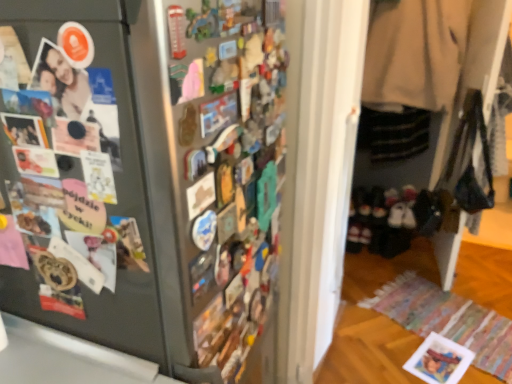
Describe the element at coordinates (85, 98) in the screenshot. I see `matte black photo at left` at that location.

Find the location of a particular element. Image resolution: width=512 pixels, height=384 pixels. satin black fridge at left is located at coordinates (149, 177).

Looking at this image, measure the distance between point (357, 243) and camera.

The depth of point (357, 243) is 2.82 meters.

Where is `beige wool coat at right`? This screenshot has height=384, width=512. beige wool coat at right is located at coordinates (415, 53).

Considering their positions, is beige wool coat at right located in front of or behind satin black fridge at left?

Clearly, beige wool coat at right is behind satin black fridge at left.

Image resolution: width=512 pixels, height=384 pixels. I want to click on clothing behind the satin black fridge at left, so click(415, 53).

Which is less distant, (383, 40) or (138, 121)?

Clearly, point (383, 40) is more distant from the camera than point (138, 121).

Is matte black photo at left oriented towards black suede shoes at lower right?

→ No.

Considering the points (69, 93) and (424, 230), which point is behind, point (69, 93) or point (424, 230)?

The point (424, 230) is behind.

Is matte black photo at left smaller than black suede shoes at lower right?

Yes.

Can you tell me how much satin black fridge at left and matte black photo at left differ in facing direction?

The angle between the facing direction of satin black fridge at left and the facing direction of matte black photo at left is 90.4 degrees.

Which object is more forward, satin black fridge at left or matte black photo at left?

satin black fridge at left is in front.

From the picture: From a real-world perspective, is satin black fridge at left above or below matte black photo at left?

In terms of real-world spatial position, satin black fridge at left is below matte black photo at left.

This screenshot has width=512, height=384. In order to click on footwear below the matte black photo at left (from a real-world perspective) in this screenshot , I will do `click(390, 220)`.

How far apart are black suede shoes at lower right and matte black photo at left?

A distance of 2.34 meters exists between black suede shoes at lower right and matte black photo at left.

From the image's perspective, is black suede shoes at lower right over matte black photo at left?

Incorrect, from the image's perspective, black suede shoes at lower right is lower than matte black photo at left.

Based on the photo, does black suede shoes at lower right have a smaller size compared to matte black photo at left?

No.

Is beige wool coat at right positioned with its back to matte black photo at left?

No, matte black photo at left is not at the back of beige wool coat at right.

Considering the positions of point (386, 78) and point (117, 130), is point (386, 78) closer or farther from the camera than point (117, 130)?

Point (386, 78).

Considering the sizes of beige wool coat at right and matte black photo at left in the image, is beige wool coat at right bigger or smaller than matte black photo at left?

Clearly, beige wool coat at right is larger in size than matte black photo at left.

Is beige wool coat at right not near matte black photo at left?

Yes, beige wool coat at right and matte black photo at left are quite far apart.

Considering the sizes of objects satin black fridge at left and beige wool coat at right in the image provided, who is shorter, satin black fridge at left or beige wool coat at right?

beige wool coat at right is shorter.

From a real-world perspective, who is located lower, satin black fridge at left or beige wool coat at right?

satin black fridge at left is physically lower.

Does satin black fridge at left have a larger size compared to beige wool coat at right?

Yes, satin black fridge at left is bigger than beige wool coat at right.

Which object is wider, satin black fridge at left or beige wool coat at right?

satin black fridge at left.

Are matte black photo at left and beige wool coat at right located far from each other?

matte black photo at left is far away from beige wool coat at right.

Considering the relative sizes of matte black photo at left and beige wool coat at right in the image provided, is matte black photo at left wider than beige wool coat at right?

In fact, matte black photo at left might be narrower than beige wool coat at right.

Would you say matte black photo at left contains beige wool coat at right?

Actually, beige wool coat at right is outside matte black photo at left.

Which of these two, matte black photo at left or beige wool coat at right, stands taller?

With more height is beige wool coat at right.

Where is `refrigerator on the left of beige wool coat at right`? The height and width of the screenshot is (384, 512). refrigerator on the left of beige wool coat at right is located at coordinates (149, 177).

Image resolution: width=512 pixels, height=384 pixels. I want to click on person that appears in front of the black suede shoes at lower right, so click(85, 98).

Looking at the image, which one is located further to beige wool coat at right, satin black fridge at left or matte black photo at left?

matte black photo at left is positioned further to the anchor beige wool coat at right.

Based on the photo, when comparing their distances from beige wool coat at right, does matte black photo at left or satin black fridge at left seem closer?

Among the two, satin black fridge at left is located nearer to beige wool coat at right.

When comparing their distances from beige wool coat at right, does black suede shoes at lower right or matte black photo at left seem further?

The object further to beige wool coat at right is matte black photo at left.

Based on their spatial positions, is satin black fridge at left or beige wool coat at right closer to black suede shoes at lower right?

beige wool coat at right lies closer to black suede shoes at lower right than the other object.

Considering their positions, is black suede shoes at lower right positioned further to matte black photo at left than beige wool coat at right?

black suede shoes at lower right is further to matte black photo at left.

Looking at the image, which one is located further to black suede shoes at lower right, matte black photo at left or beige wool coat at right?

matte black photo at left lies further to black suede shoes at lower right than the other object.

When comparing their distances from satin black fridge at left, does beige wool coat at right or black suede shoes at lower right seem further?

The object further to satin black fridge at left is black suede shoes at lower right.

Estimate the real-world distances between objects in this image. Which object is further from beige wool coat at right, satin black fridge at left or black suede shoes at lower right?

satin black fridge at left.

The height and width of the screenshot is (384, 512). I want to click on clothing between satin black fridge at left and black suede shoes at lower right in the front-back direction, so click(x=415, y=53).

Identify the location of person between satin black fridge at left and black suede shoes at lower right in the front-back direction. Image resolution: width=512 pixels, height=384 pixels. (85, 98).

The image size is (512, 384). What are the coordinates of `person positioned between satin black fridge at left and beige wool coat at right from near to far` in the screenshot? It's located at (85, 98).

Where is `clothing positioned between matte black photo at left and black suede shoes at lower right from near to far`? clothing positioned between matte black photo at left and black suede shoes at lower right from near to far is located at coordinates (415, 53).